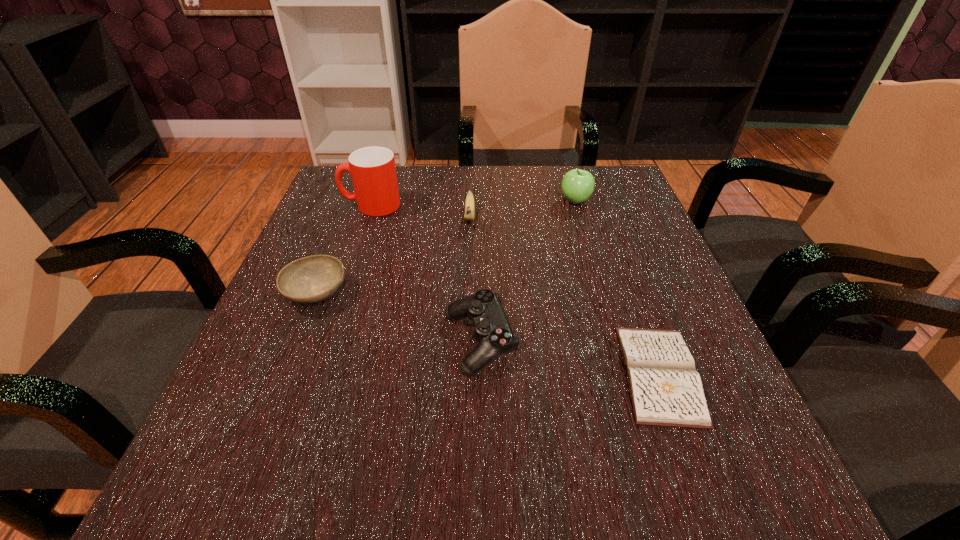
The width and height of the screenshot is (960, 540). In the image, there is a desktop. Identify the location of free region at the far edge. (420, 177).

At what (x,y) coordinates should I click in order to perform the action: click on vacant space at the near edge. Please return your answer as a coordinate pair (x, y). Looking at the image, I should click on (348, 506).

You are a GUI agent. You are given a task and a screenshot of the screen. Output one action in this format:
    pyautogui.click(x=<x>, y=<y>)
    Task: Click on the vacant space at the left edge of the desktop
    Image resolution: width=960 pixels, height=540 pixels.
    Given the screenshot: What is the action you would take?
    pyautogui.click(x=327, y=352)

The width and height of the screenshot is (960, 540). In the image, there is a desktop. What are the coordinates of `vacant space at the right edge` in the screenshot? It's located at (607, 256).

Find the location of a particular element. vacant position at the far left corner of the desktop is located at coordinates point(325,191).

This screenshot has width=960, height=540. In order to click on vacant region at the far right corner of the desktop in this screenshot , I will do `click(595, 179)`.

Where is `free point between the cup and the control`? free point between the cup and the control is located at coordinates (425, 274).

Identify the location of free space between the banana and the control. This screenshot has height=540, width=960. coord(475,280).

What are the coordinates of `vacant area that lies between the second shortest object and the fifth shortest object` in the screenshot? It's located at (445, 247).

What are the coordinates of `empty location between the bowl and the cup` in the screenshot? It's located at (344, 249).